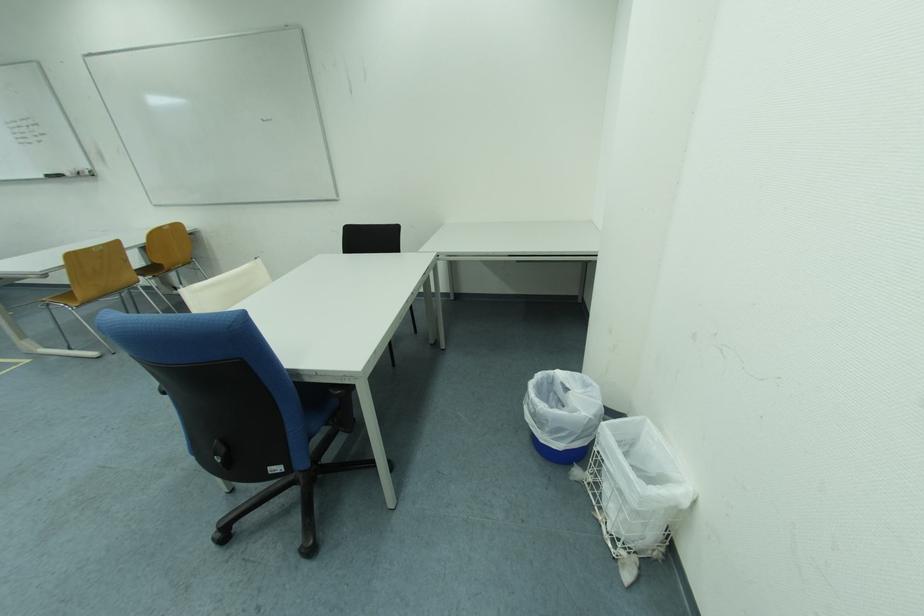
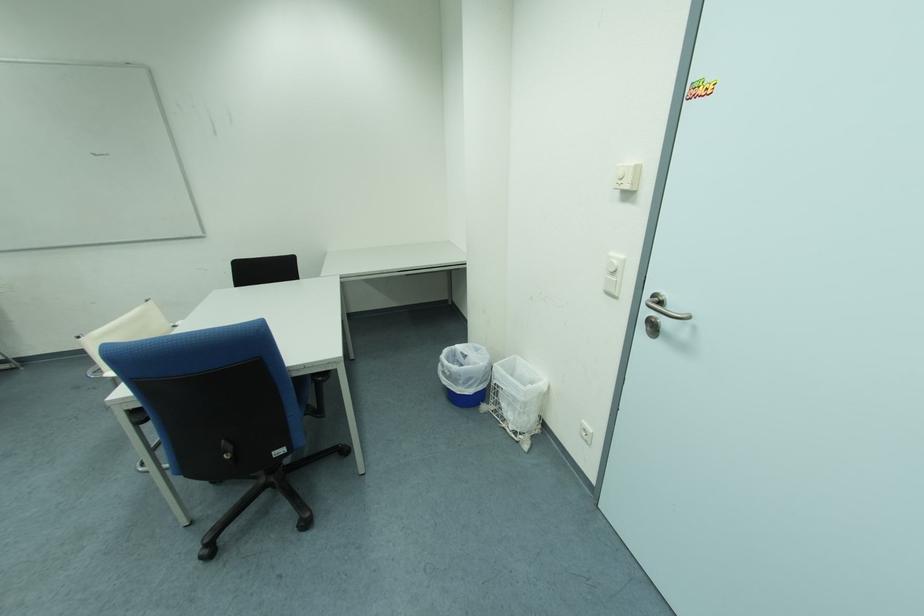
Locate, in the second image, the point that corresponds to (594,387) in the first image.

(485, 352)